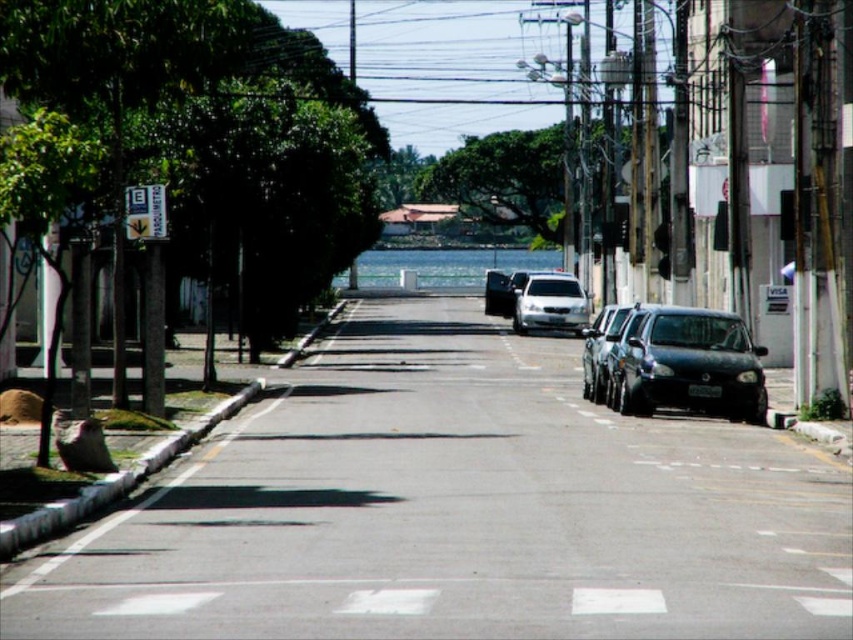
Question: Which point is closer to the camera?

Choices:
 (A) white matte car at center
 (B) shiny black sedan at center right

Answer: (B)

Question: Does white matte car at center come behind shiny black sedan at center right?

Choices:
 (A) no
 (B) yes

Answer: (B)

Question: Is white matte car at center thinner than shiny black sedan at center right?

Choices:
 (A) no
 (B) yes

Answer: (A)

Question: Does shiny black sedan at center right lie behind shiny silver sedan at center?

Choices:
 (A) yes
 (B) no

Answer: (B)

Question: Which object is positioned farthest from the shiny black sedan at right?

Choices:
 (A) white matte car at center
 (B) shiny black sedan at center right

Answer: (A)

Question: Which of these objects is positioned closest to the white matte car at center?

Choices:
 (A) shiny black sedan at center right
 (B) shiny silver sedan at center
 (C) shiny black sedan at right

Answer: (B)